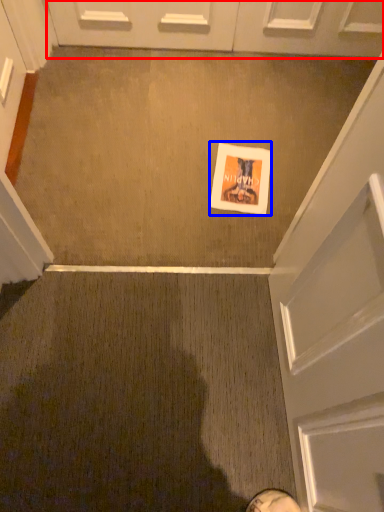
Question: Which object is closer to the camera taking this photo, door (highlighted by a red box) or flyer (highlighted by a blue box)?

Choices:
 (A) door
 (B) flyer

Answer: (B)